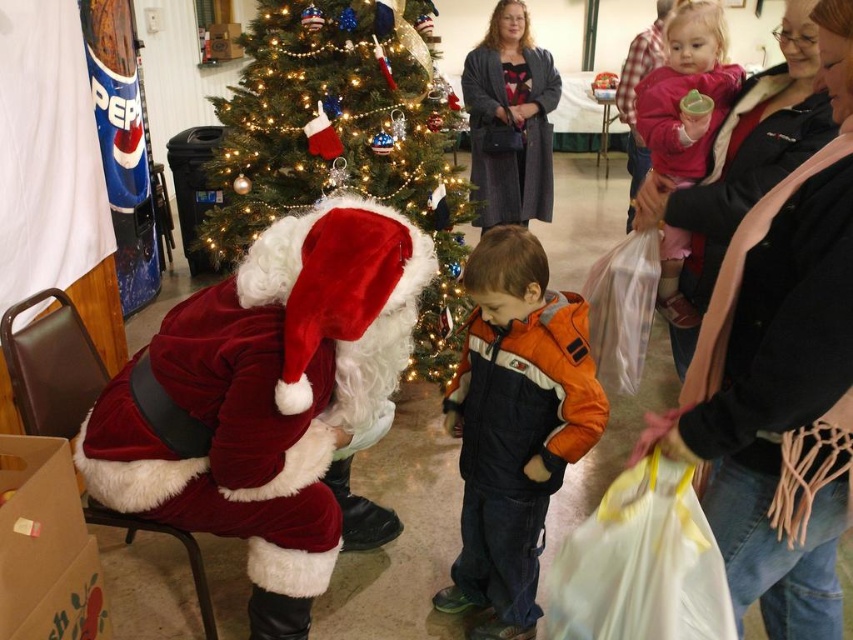
You are a photographer at the event and want to capture a photo that includes both the brown paper box at lower left and the pink fleece jacket at upper right. Which object should you position closer to the left side of the frame to ensure both are visible?

The brown paper box at lower left should be positioned closer to the left side of the frame since it is already on the left side of the pink fleece jacket at upper right.

You are a photographer trying to capture a photo of the shiny green christmas tree at center and the pink fleece jacket at upper right. Since you want both objects to be clearly visible in the photo, which object should you focus on first to ensure proper focus?

The shiny green christmas tree at center is taller than the pink fleece jacket at upper right, so you should focus on the shiny green christmas tree at center first to ensure both are in focus.

You are standing in the festive scene and want to place a new decoration on the shiny green christmas tree at center. The coordinates provided are point (343,140). Can you confirm if this point is located on the shiny green christmas tree at center?

Yes, the point (343,140) is on the shiny green christmas tree at center, so placing the decoration there would be appropriate.